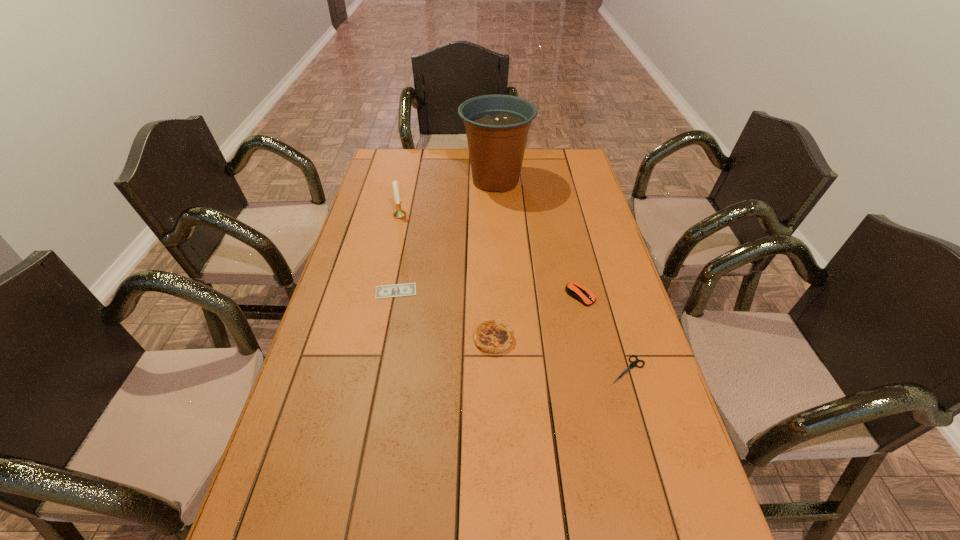
Image resolution: width=960 pixels, height=540 pixels. In order to click on free space located 0.240m on the front of the second farthest object in this screenshot , I will do `click(389, 262)`.

Where is `vacant space positioned 0.080m on the right of the computer mouse`? The image size is (960, 540). vacant space positioned 0.080m on the right of the computer mouse is located at coordinates (621, 296).

Locate an element on the screen. The width and height of the screenshot is (960, 540). vacant space situated on the right of the fifth farthest object is located at coordinates [620, 339].

This screenshot has width=960, height=540. In order to click on vacant space located on the left of the shears in this screenshot , I will do `click(563, 369)`.

This screenshot has height=540, width=960. I want to click on free spot located 0.050m on the right of the money, so click(433, 291).

Identify the location of object situated at the far edge. (497, 126).

The image size is (960, 540). I want to click on candle holder that is at the left edge, so click(399, 213).

Find the location of a particular element. money positioned at the left edge is located at coordinates (409, 289).

At what (x,y) coordinates should I click in order to perform the action: click on computer mouse at the right edge. Please return your answer as a coordinate pair (x, y). This screenshot has width=960, height=540. Looking at the image, I should click on (576, 290).

Identify the location of shears that is positioned at the right edge. (633, 364).